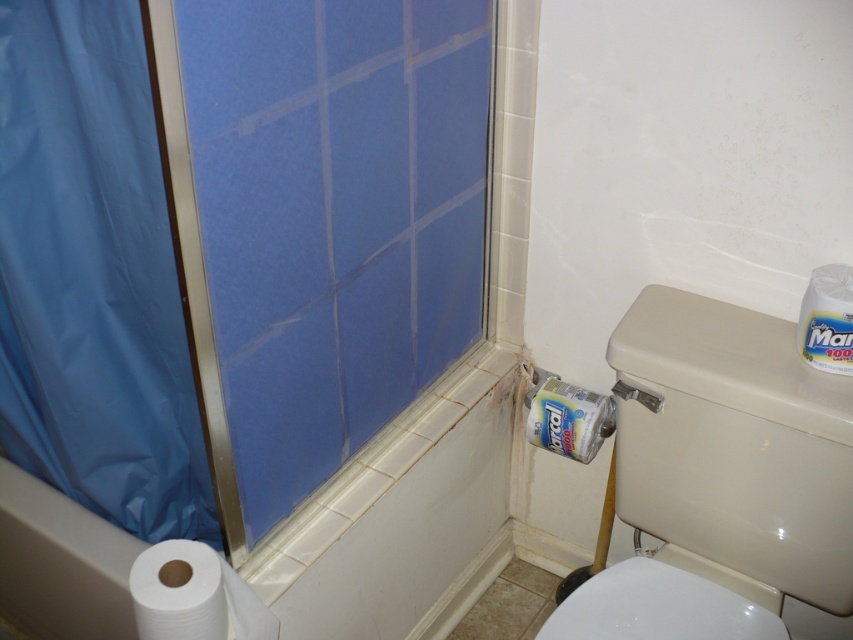
Between point (90, 220) and point (175, 604), which one is positioned behind?

The point (90, 220) is behind.

Can you confirm if blue plastic shower curtain at left is positioned to the right of white paper at lower left?

Incorrect, blue plastic shower curtain at left is not on the right side of white paper at lower left.

In order to click on blue plastic shower curtain at left in this screenshot , I will do `click(91, 275)`.

This screenshot has width=853, height=640. Find the location of `blue plastic shower curtain at left`. blue plastic shower curtain at left is located at coordinates (91, 275).

Locate an element on the screen. The image size is (853, 640). white glossy toilet bowl at lower center is located at coordinates pos(657,608).

Does white glossy toilet bowl at lower center lie in front of matte plastic toilet paper holder at lower right?

Yes.

You are a GUI agent. You are given a task and a screenshot of the screen. Output one action in this format:
    pyautogui.click(x=<x>, y=<y>)
    Task: Click on the white glossy toilet bowl at lower center
    The height and width of the screenshot is (640, 853).
    Given the screenshot: What is the action you would take?
    pyautogui.click(x=657, y=608)

The height and width of the screenshot is (640, 853). Identify the location of white glossy toilet bowl at lower center. pos(657,608).

Does point (152, 586) lie behind point (611, 420)?

No, (152, 586) is in front of (611, 420).

Which is behind, point (195, 604) or point (581, 444)?

Positioned behind is point (581, 444).

Measure the distance between point (x=202, y=588) and camera.

The distance of point (x=202, y=588) from camera is 37.47 inches.

Find the location of a particular element. This screenshot has height=640, width=853. white paper at lower left is located at coordinates (193, 595).